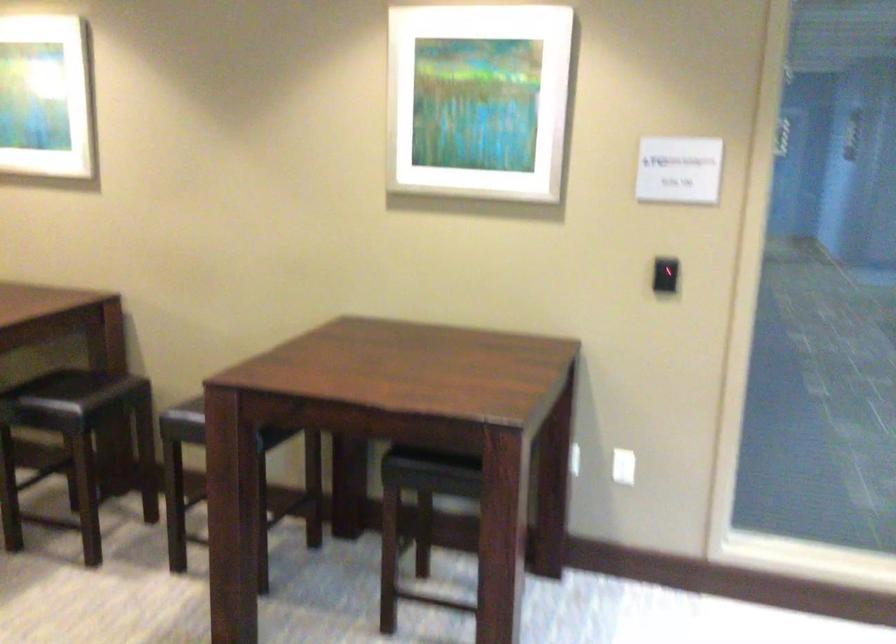
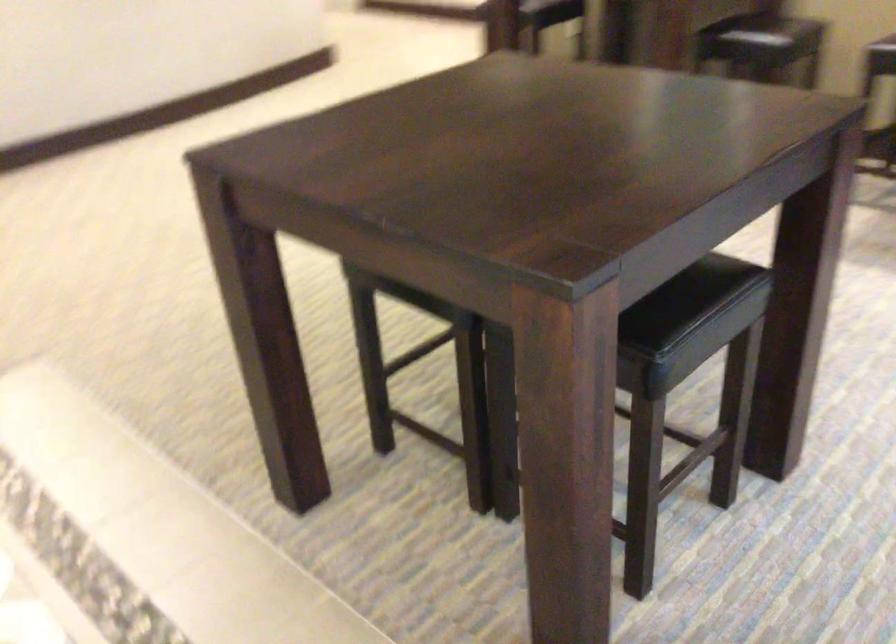
Based on the continuous images, in which direction is the camera rotating?

The camera's rotation is toward left-down.